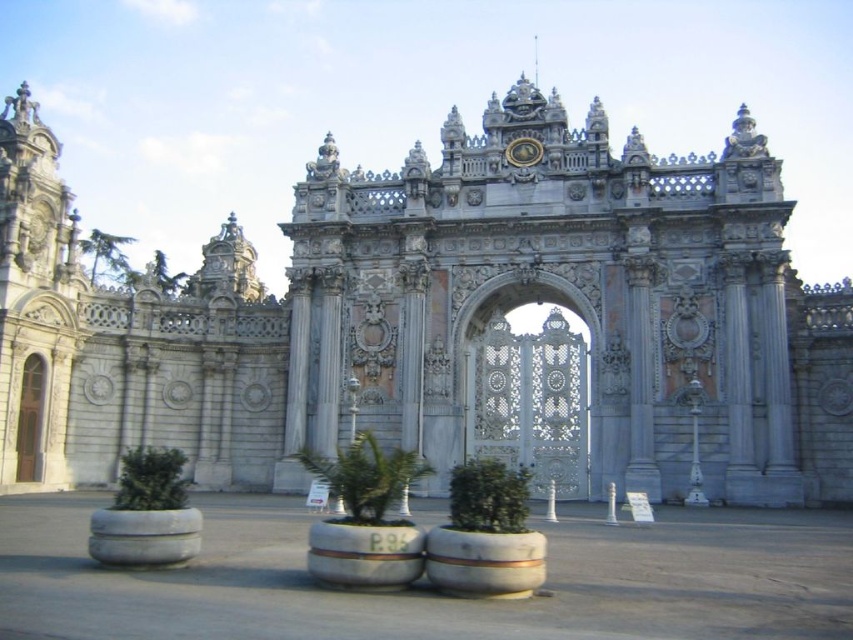
You are a visitor approaching the entrance of the palace. You see the white stone gate at center and the wooden door at left. Which one is bigger in size?

The white stone gate at center has a larger size compared to the wooden door at left, so the white stone gate at center is bigger.

Based on the photo, you are standing in front of the white stone gate at center and the wooden door at left. Which one is positioned to the right side?

The white stone gate at center is positioned to the right of the wooden door at left.

You are an architect evaluating the structural integrity of the white stone gate at center and the wooden door at left. Based on their heights, which one might require a stronger foundation to support its weight?

The white stone gate at center has a greater height compared to the wooden door at left, so it likely requires a stronger foundation to support its weight.